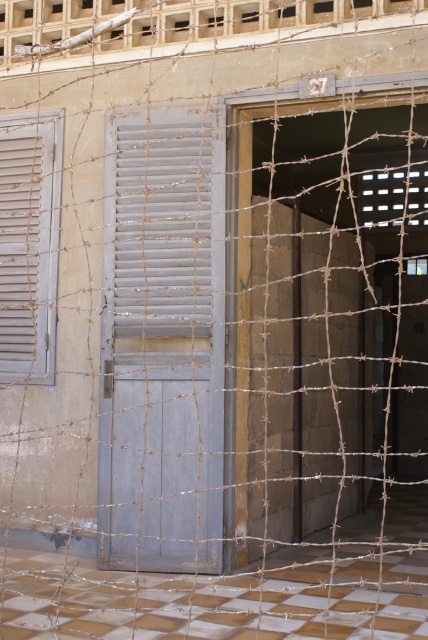
Where is `gray matte door at center`? gray matte door at center is located at coordinates (163, 340).

Who is positioned more to the left, gray matte door at center or white matte shutter at center?

Positioned to the left is gray matte door at center.

Does point (142, 518) come farther from viewer compared to point (171, 225)?

That is False.

Identify the location of gray matte door at center. The image size is (428, 640). (163, 340).

Between white matte shutter at center and light gray wooden shutter at left, which one has more height?

Standing taller between the two is light gray wooden shutter at left.

Does point (149, 285) lie in front of point (53, 266)?

Yes, it is in front of point (53, 266).

You are a GUI agent. You are given a task and a screenshot of the screen. Output one action in this format:
    pyautogui.click(x=<x>, y=<y>)
    Task: Click on the white matte shutter at center
    This screenshot has height=640, width=428.
    Given the screenshot: What is the action you would take?
    pyautogui.click(x=163, y=230)

Is gray matte door at center above light gray wooden shutter at left?

Incorrect, gray matte door at center is not positioned above light gray wooden shutter at left.

In the scene shown: Who is more distant from viewer, (181, 256) or (50, 248)?

Answer: Point (50, 248)

At what (x,y) coordinates should I click in order to perform the action: click on gray matte door at center. Please return your answer as a coordinate pair (x, y). The image size is (428, 640). Looking at the image, I should click on (163, 340).